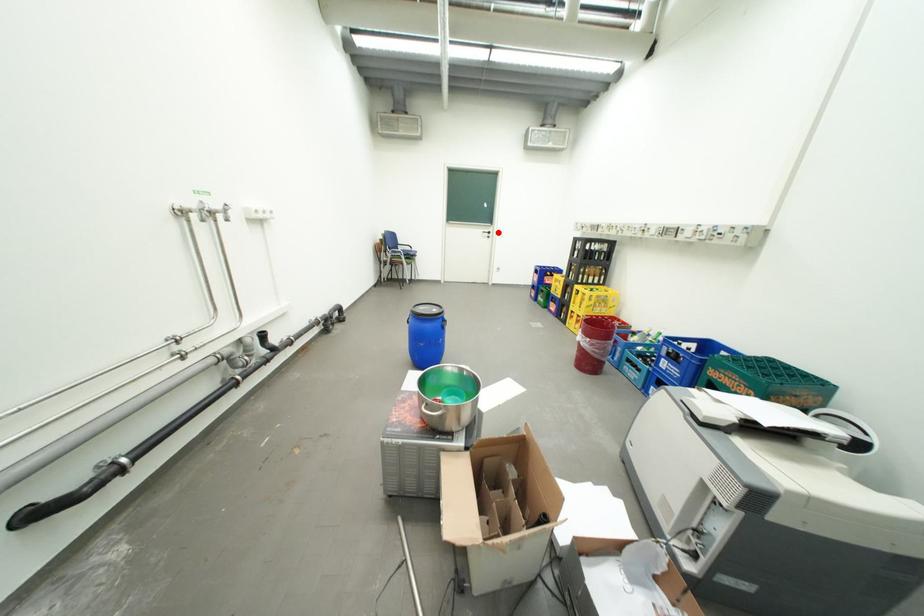
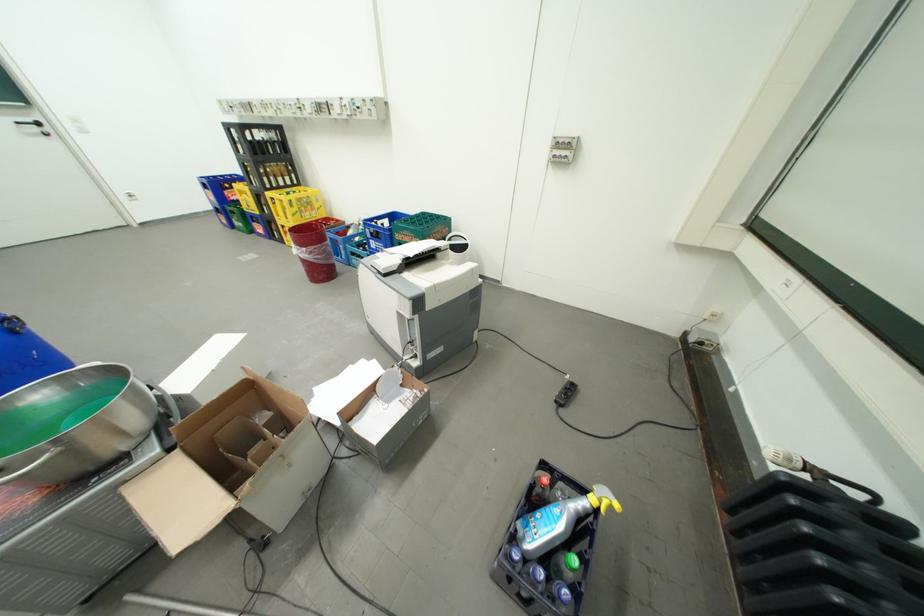
Question: I am providing you with two images of the same scene from different viewpoints. A red point is shown in image1. For the corresponding object point in image2, is it positioned nearer or farther from the camera?

Choices:
 (A) Nearer
 (B) Farther

Answer: (B)